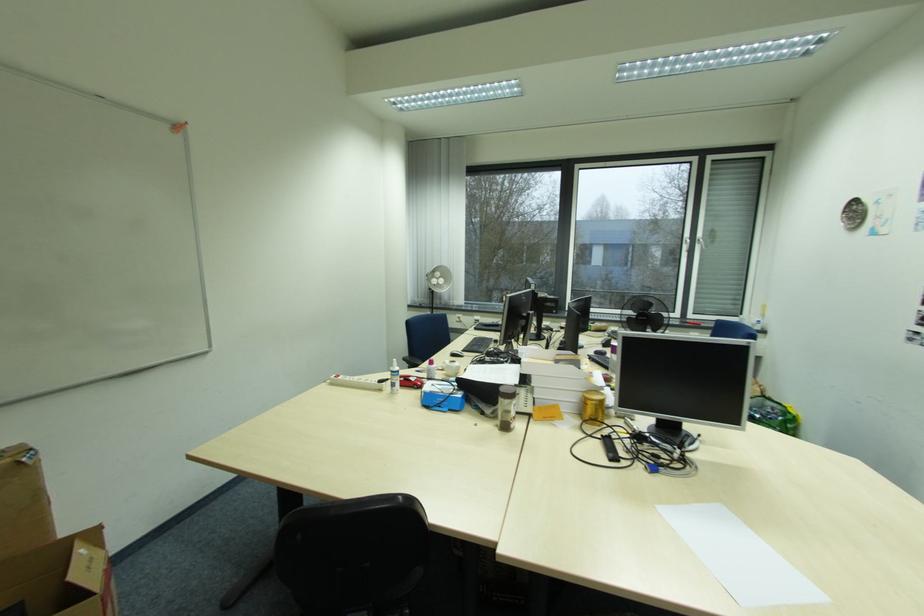
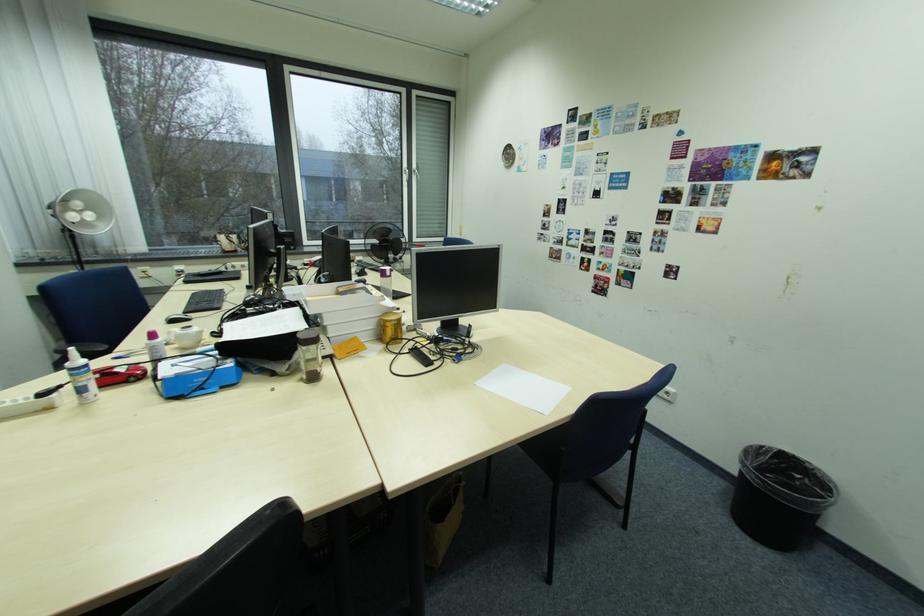
Find the pixel in the second image that matches point 398,376 in the first image.

(80, 376)